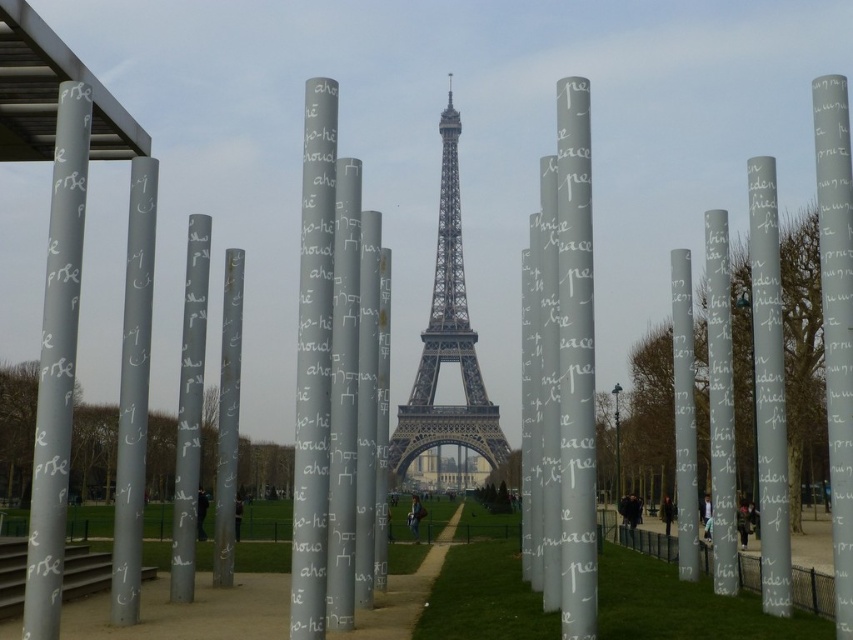
Which is in front, point (828, 244) or point (770, 196)?

Positioned in front is point (828, 244).

Between point (840, 337) and point (769, 280), which one is positioned behind?

The point (769, 280) is more distant.

I want to click on silver metallic pillar at right, so click(836, 320).

Is point (358, 624) farther from viewer compared to point (846, 433)?

Yes, point (358, 624) is farther from viewer.

Is smooth concrete path at center wider than silver metallic pillar at right?

Yes.

The height and width of the screenshot is (640, 853). I want to click on smooth concrete path at center, so click(190, 611).

Who is more distant from viewer, (828,310) or (404,435)?

Point (828,310)

Does silver metallic pillar at right have a lesser height compared to metallic silver eiffel tower at center?

No.

Between point (839, 371) and point (457, 410), which one is positioned behind?

The point (457, 410) is behind.

You are a GUI agent. You are given a task and a screenshot of the screen. Output one action in this format:
    pyautogui.click(x=<x>, y=<y>)
    Task: Click on the silver metallic pillar at right
    This screenshot has height=640, width=853.
    Given the screenshot: What is the action you would take?
    pyautogui.click(x=836, y=320)